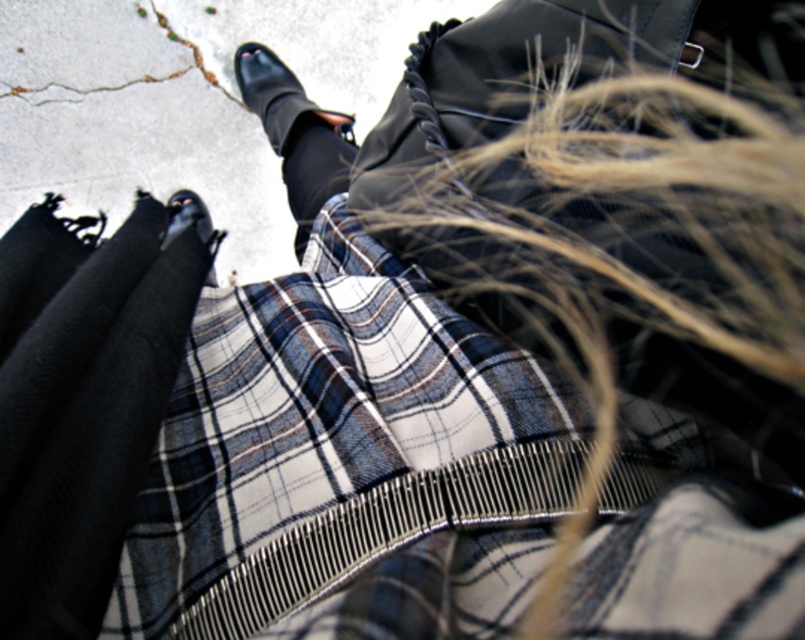
You are standing at the origin point and want to move to the black smooth sock at center. What are the coordinates you need to move to?

The coordinates you need to move to are 0.266 in the x direction and 0.390 in the y direction.

You are standing at the point with coordinates point (176,205) and want to move towards the point with coordinates point (316,196). Which direction should you move relative to your current position?

You should move forward because point (316,196) is in front of point (176,205).

You are holding a 10 inch ruler and want to measure the distance between yourself and the point marked at coordinates point (609, 592). Can you reach it without moving your hand?

The distance between you and the point marked at coordinates point (609, 592) is 9.55 inches, so yes, you can reach it with a 10 inch ruler without moving your hand since the ruler is longer than the distance.